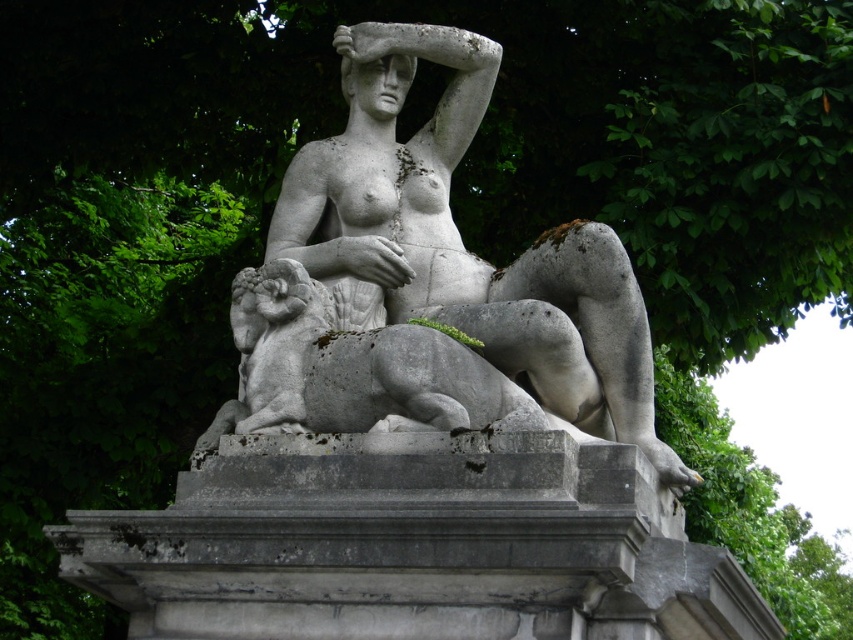
You are an art conservator assessing the space between two central objects in the image. The gray stone statue at center and the gray stone lion at center. You need to place a protective barrier between them. Given that the barrier requires at least 0.5 meters of space to function properly, can you determine if there is enough space between them based on their widths?

The gray stone statue at center has a larger width than the gray stone lion at center, but the exact distance between them isn not specified. Without knowing the actual spacing between the two objects, it is impossible to determine if there is sufficient space for the barrier.

You are an art conservator examining two statues in a garden. You see the gray stone statue at center and the white stone statue at center. Which one is located to the right of the other?

The gray stone statue at center is positioned on the right side of the white stone statue at center.